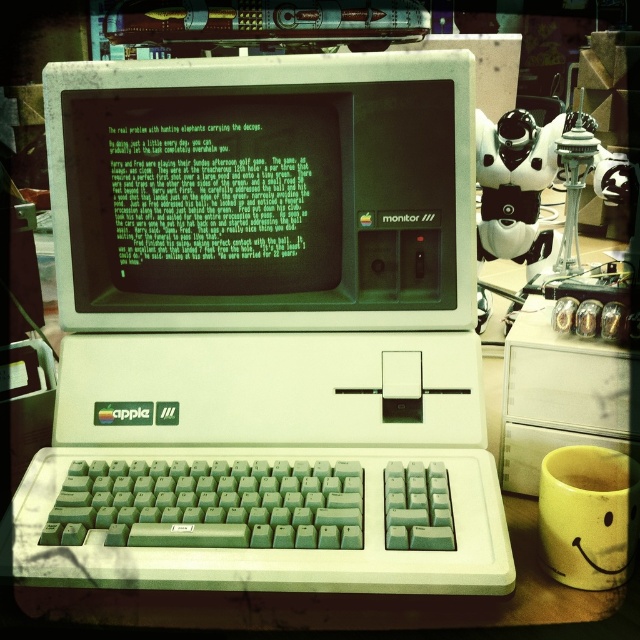
Question: Which of these objects is positioned closest to the matte white monitor at center?

Choices:
 (A) yellow matte mug at lower right
 (B) white plastic apple iii monitor at center

Answer: (B)

Question: Which of the following is the farthest from the observer?

Choices:
 (A) (179, 157)
 (B) (227, 186)
 (C) (600, 564)

Answer: (B)

Question: Is matte white monitor at center wider than yellow matte mug at lower right?

Choices:
 (A) yes
 (B) no

Answer: (A)

Question: From the image, what is the correct spatial relationship of white plastic apple iii monitor at center in relation to yellow matte mug at lower right?

Choices:
 (A) above
 (B) below

Answer: (A)

Question: Which point is farther to the camera?

Choices:
 (A) matte white monitor at center
 (B) white plastic apple iii monitor at center

Answer: (A)

Question: Where is matte white monitor at center located in relation to yellow matte mug at lower right in the image?

Choices:
 (A) above
 (B) below

Answer: (A)